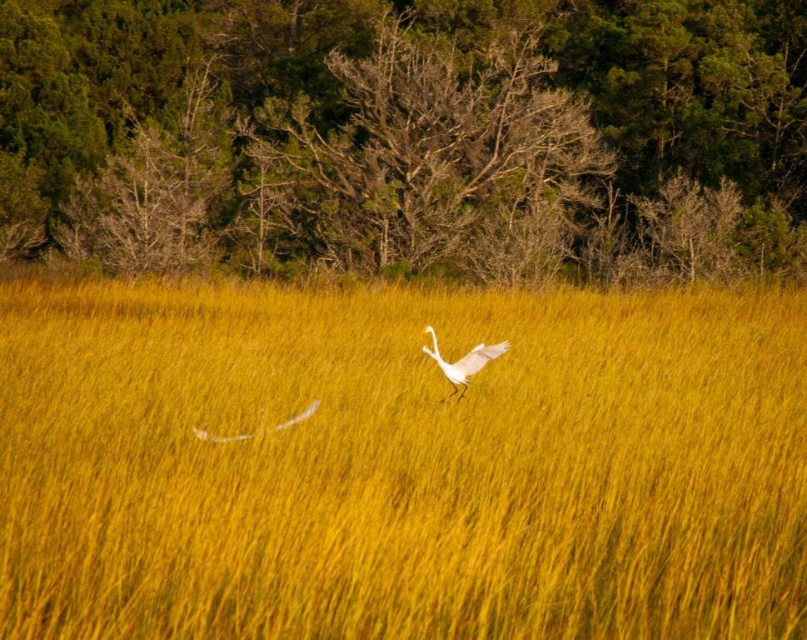
Question: Which point is closer to the camera?

Choices:
 (A) (308, 404)
 (B) (425, 349)

Answer: (A)

Question: Observing the image, what is the correct spatial positioning of yellow grass at center in reference to white feather at center?

Choices:
 (A) above
 (B) below

Answer: (A)

Question: Which object is farther from the camera taking this photo?

Choices:
 (A) white matte bird at center
 (B) white feather at center
 (C) yellow grass at center

Answer: (A)

Question: Is yellow grass at center to the left of white matte bird at center from the viewer's perspective?

Choices:
 (A) yes
 (B) no

Answer: (A)

Question: Among these points, which one is nearest to the camera?

Choices:
 (A) (644, 300)
 (B) (479, 348)
 (C) (272, 426)

Answer: (C)

Question: From the image, what is the correct spatial relationship of yellow grass at center in relation to white feather at center?

Choices:
 (A) above
 (B) below

Answer: (A)